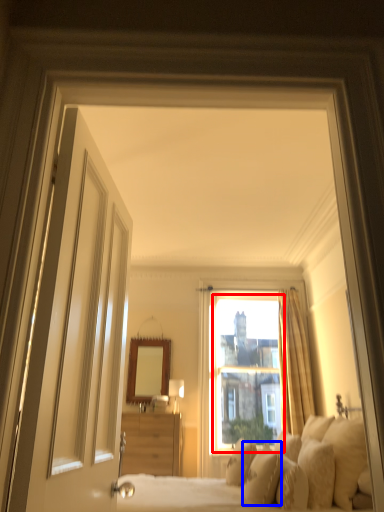
Question: Which point is closer to the camera, window screen (highlighted by a red box) or pillow (highlighted by a blue box)?

Choices:
 (A) window screen
 (B) pillow

Answer: (B)